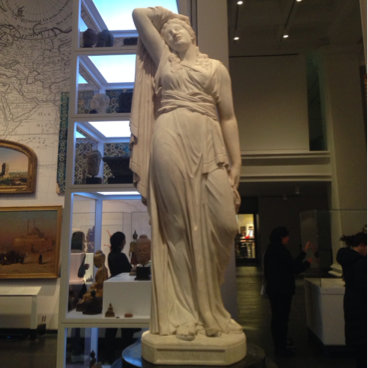
The width and height of the screenshot is (368, 368). I want to click on window (ceiling), so click(x=121, y=10).